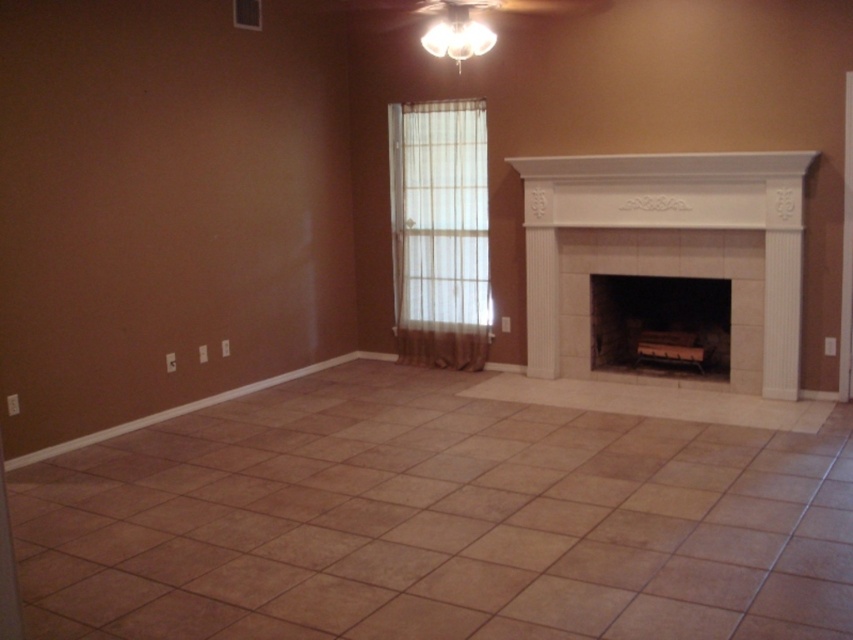
You are a contractor measuring the dimensions of the room. You see two fireplaces in the image, the white tile fireplace at center and the white stone fireplace at center. Which one has a greater width?

The white tile fireplace at center has a greater width than the white stone fireplace at center according to the description.